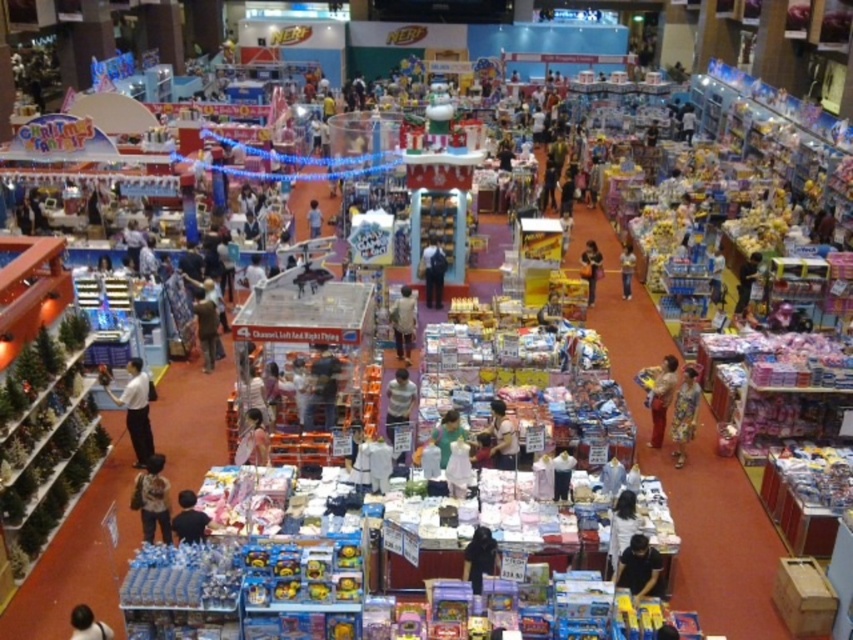
Question: Which of the following is the closest to the observer?

Choices:
 (A) (640, 536)
 (B) (126, 413)
 (C) (161, 497)

Answer: (A)

Question: Does white matte shirt at center have a smaller size compared to light brown leather jacket at center?

Choices:
 (A) yes
 (B) no

Answer: (A)

Question: Which object is positioned farthest from the green fabric dress at center?

Choices:
 (A) matte black bag at center
 (B) pink fabric dress at center

Answer: (A)

Question: Is matte black shirt at lower left thinner than black matte shirt at lower center?

Choices:
 (A) no
 (B) yes

Answer: (B)

Question: Can you confirm if white matte shirt at lower left is smaller than black matte shirt at lower center?

Choices:
 (A) no
 (B) yes

Answer: (A)

Question: Which point appears farthest from the camera in this image?

Choices:
 (A) (691, 426)
 (B) (252, 440)
 (C) (486, 554)
 (D) (585, 244)

Answer: (D)